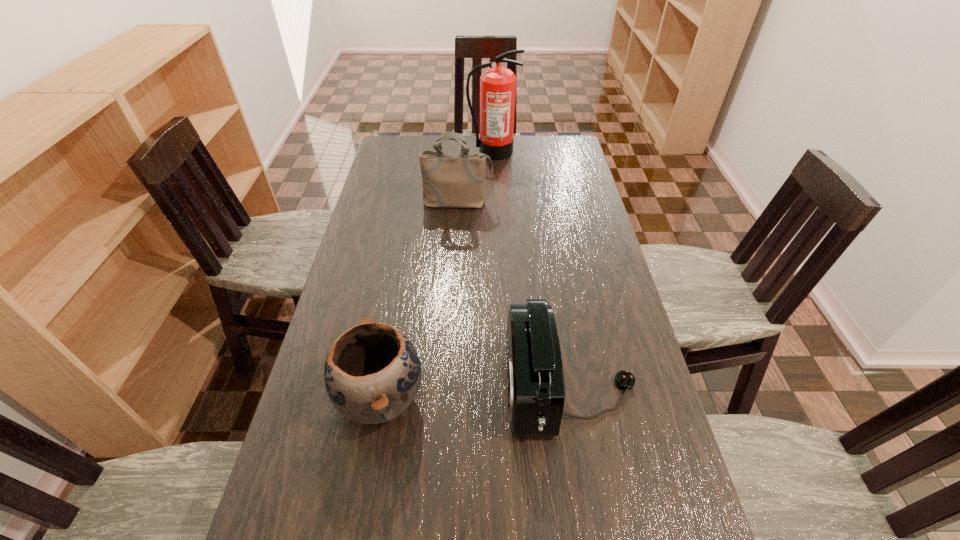
Locate an element on the screen. free space located on the front-facing side of the radio receiver is located at coordinates (x=377, y=386).

At what (x,y) coordinates should I click in order to perform the action: click on free spot located on the right of the pottery. Please return your answer as a coordinate pair (x, y). This screenshot has height=540, width=960. Looking at the image, I should click on (585, 397).

Locate an element on the screen. This screenshot has height=540, width=960. object located at the far edge is located at coordinates click(x=497, y=85).

The image size is (960, 540). I want to click on object present at the left edge, so click(372, 372).

This screenshot has height=540, width=960. I want to click on object that is at the right edge, so click(535, 379).

Find the location of a particular element. free region at the far edge of the desktop is located at coordinates (469, 139).

Where is `free space at the left edge of the desktop`? The height and width of the screenshot is (540, 960). free space at the left edge of the desktop is located at coordinates (327, 417).

The height and width of the screenshot is (540, 960). In order to click on free space at the right edge in this screenshot , I will do `click(624, 300)`.

This screenshot has height=540, width=960. In order to click on free space between the pottery and the fire extinguisher in this screenshot , I will do `click(437, 274)`.

You are a GUI agent. You are given a task and a screenshot of the screen. Output one action in this format:
    pyautogui.click(x=<x>, y=<y>)
    Task: Click on the blank region between the third nearest object and the pottery
    The image size is (960, 540).
    Given the screenshot: What is the action you would take?
    pyautogui.click(x=420, y=300)